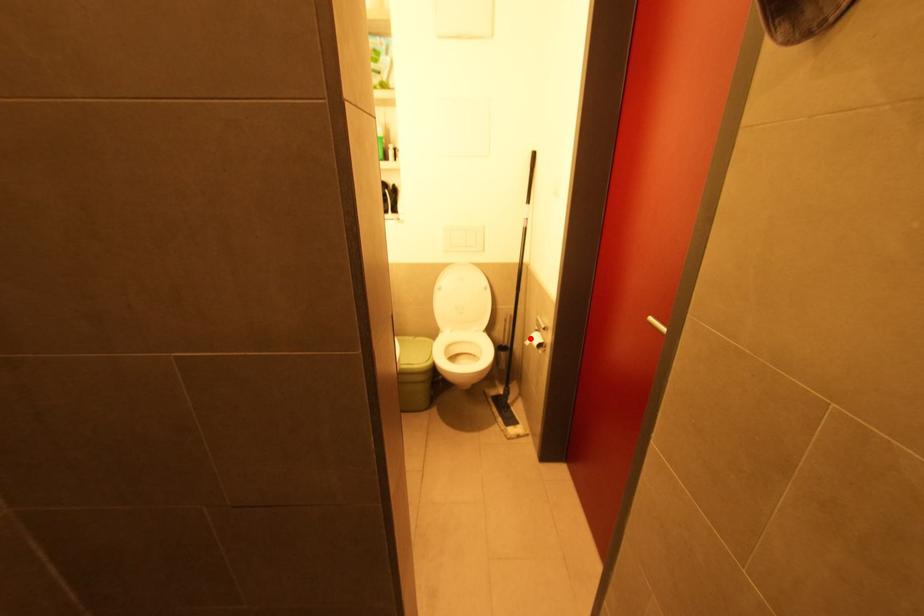
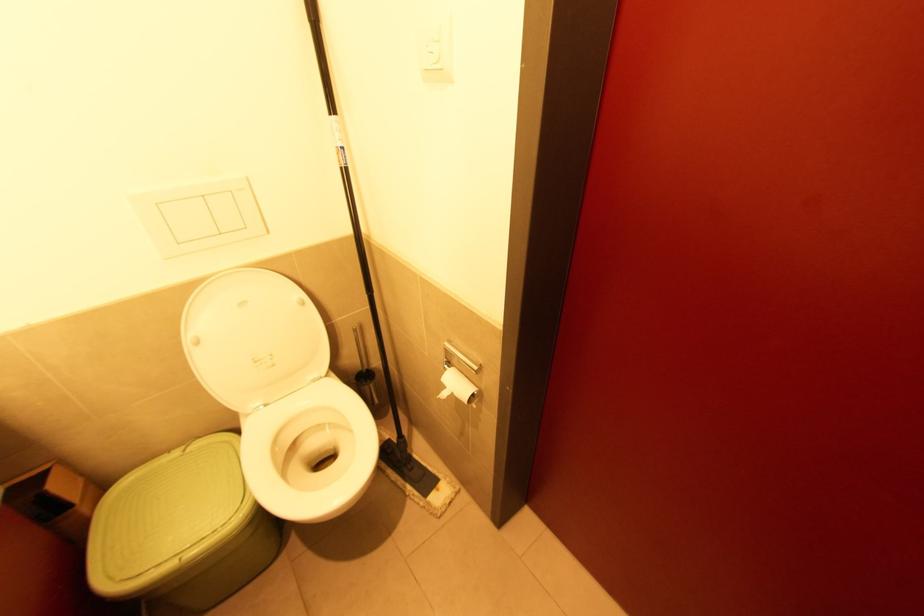
Question: A red point is marked in image1. In image2, is the corresponding 3D point closer to the camera or farther? Reply with the corresponding letter.

Choices:
 (A) The corresponding 3D point is closer.
 (B) The corresponding 3D point is farther.

Answer: (B)